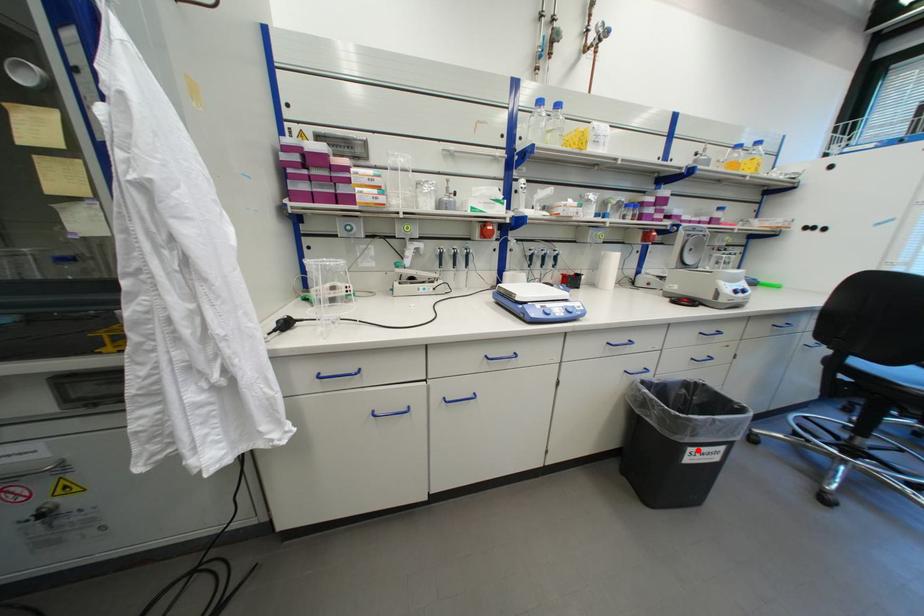
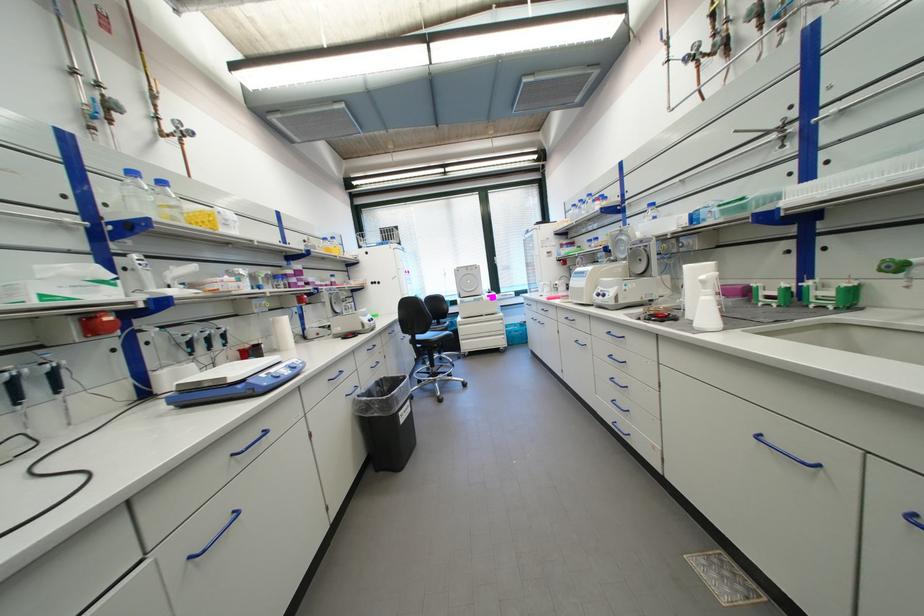
Question: I am providing you with two images of the same scene from different viewpoints. A red point is shown in image1. For the corresponding object point in image2, is it positioned nearer or farther from the camera?

Choices:
 (A) Nearer
 (B) Farther

Answer: (A)